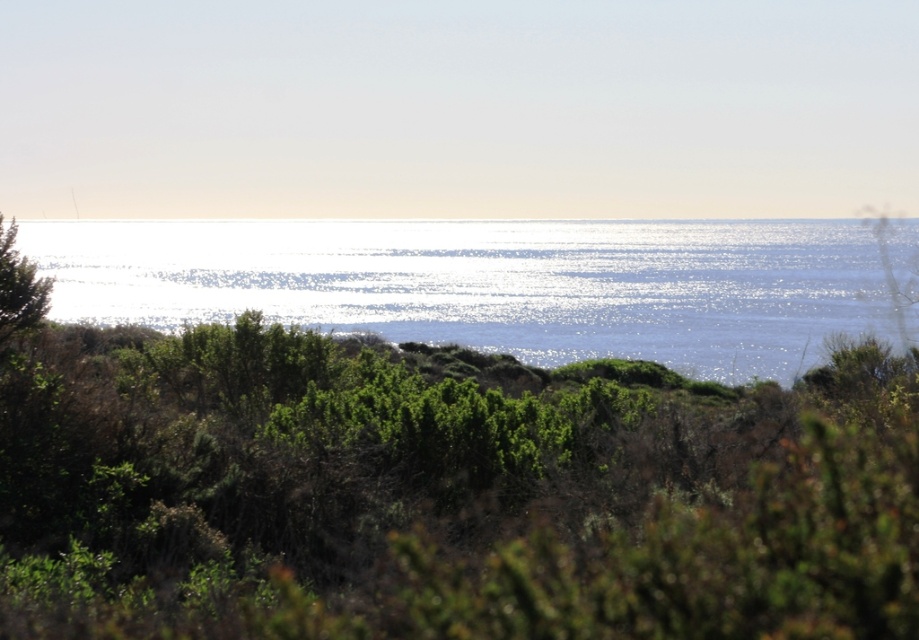
Question: Which object is closer to the camera taking this photo?

Choices:
 (A) glistening blue water at center
 (B) green leafy tree at left

Answer: (B)

Question: Which of the following is the closest to the observer?

Choices:
 (A) green leafy tree at left
 (B) green leafy bush at upper center
 (C) glistening blue water at center

Answer: (B)

Question: Is green leafy bush at upper center bigger than glistening blue water at center?

Choices:
 (A) yes
 (B) no

Answer: (B)

Question: Which point appears closest to the camera in this image?

Choices:
 (A) (268, 499)
 (B) (47, 291)
 (C) (845, 328)

Answer: (A)

Question: Is glistening blue water at center bigger than green leafy tree at left?

Choices:
 (A) no
 (B) yes

Answer: (B)

Question: Observing the image, what is the correct spatial positioning of glistening blue water at center in reference to green leafy tree at left?

Choices:
 (A) left
 (B) right

Answer: (B)